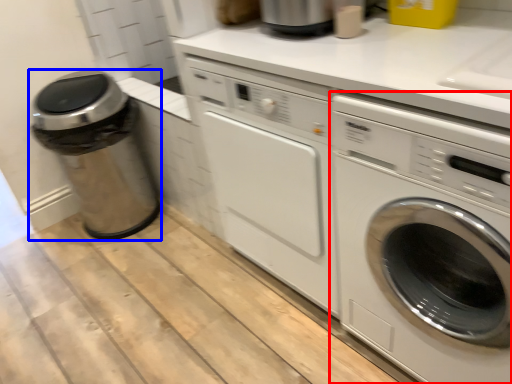
Question: Among these objects, which one is farthest to the camera, washing machine (highlighted by a red box) or garbage (highlighted by a blue box)?

Choices:
 (A) washing machine
 (B) garbage

Answer: (B)